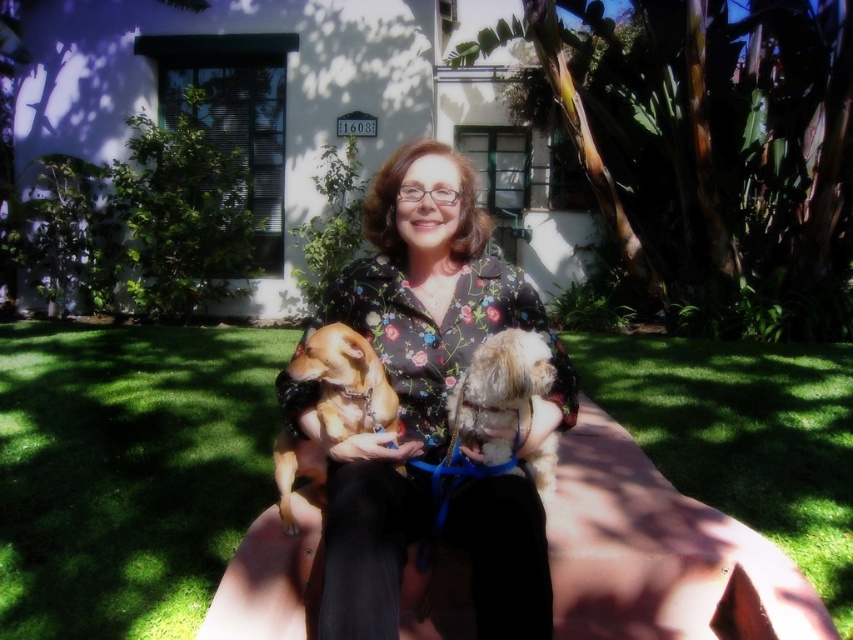
You are standing at the point with coordinates point (393, 186) and want to walk towards the point with coordinates point (531, 332). Which direction should you move?

You should move away from the viewer since point (393, 186) is closer to you than point (531, 332).

You are standing at the point labeled point (x=527, y=358) in the image. If you want to walk towards the point labeled point (x=343, y=396), which direction should you move?

You should move downward and to the right because point (x=343, y=396) is behind point (x=527, y=358).

You are standing at the center of the garden and see the point at coordinates point [346,381]. What is located at that point?

The point [346,381] is located on golden brown fur at center.